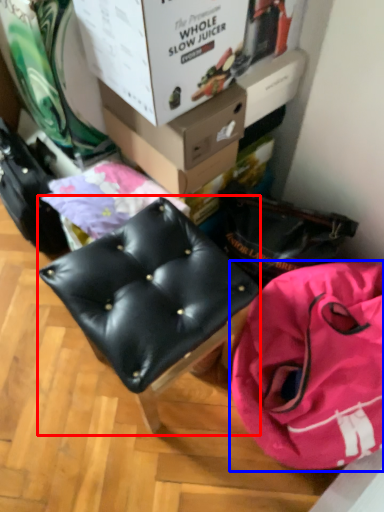
Question: Which point is further to the camera, furniture (highlighted by a red box) or handbag (highlighted by a blue box)?

Choices:
 (A) furniture
 (B) handbag

Answer: (B)